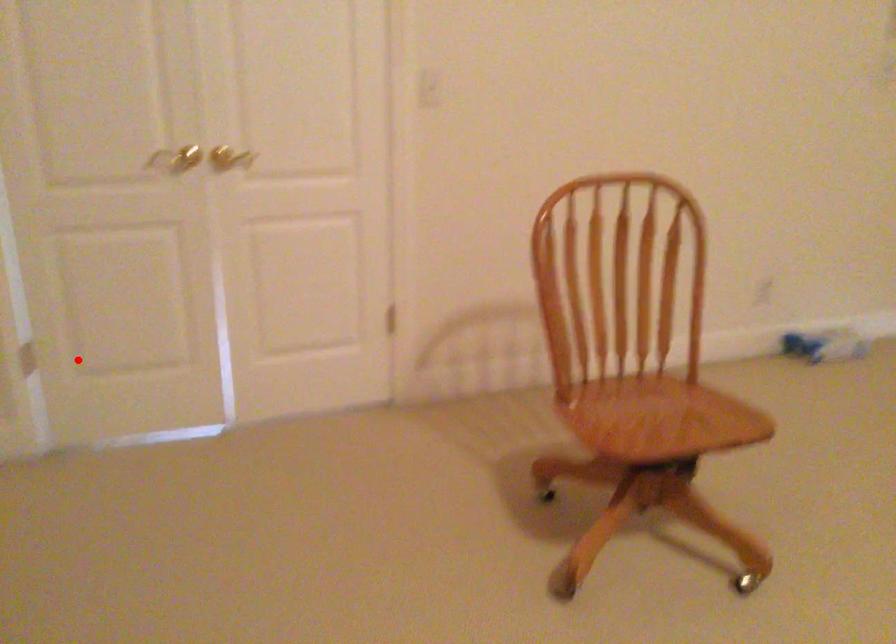
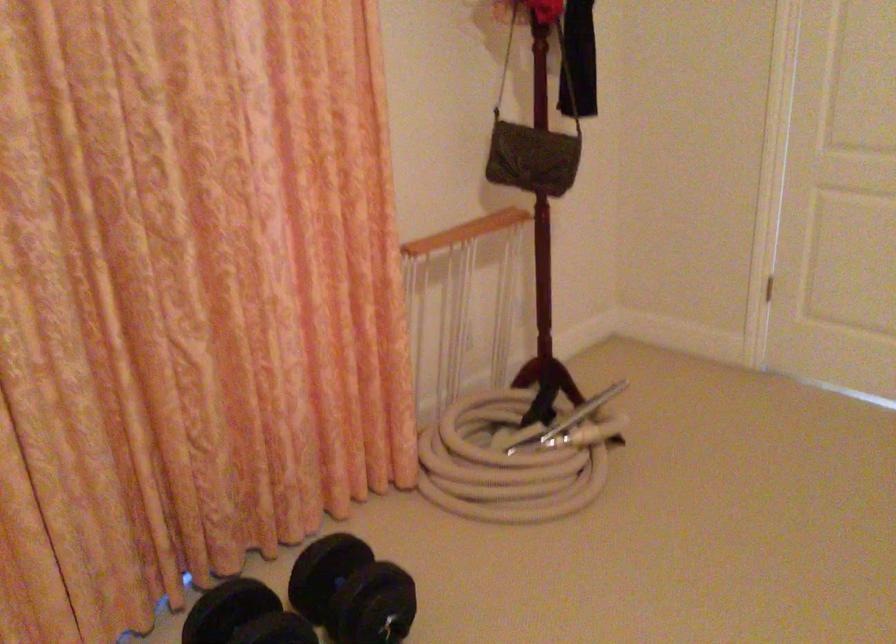
Where in the second image is the point corresponding to the highlighted location from the first image?

(762, 283)